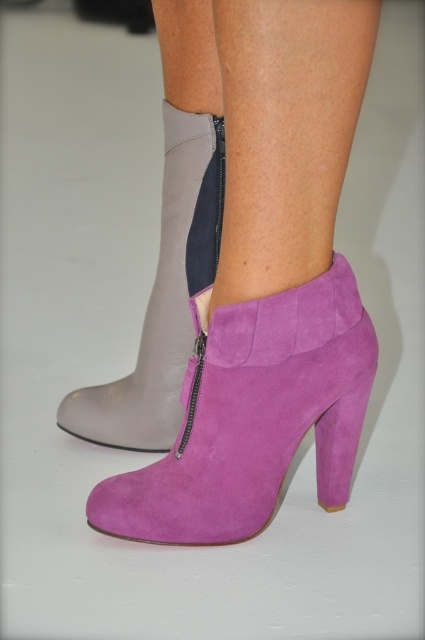
Question: Can you confirm if suede purple boot at lower right is wider than purple suede heel at lower right?

Choices:
 (A) no
 (B) yes

Answer: (B)

Question: Which point appears closest to the camera in this image?

Choices:
 (A) (282, 394)
 (B) (181, 212)
 (C) (132, 385)

Answer: (A)

Question: Which point appears closest to the camera in this image?

Choices:
 (A) (x=325, y=504)
 (B) (x=192, y=118)

Answer: (B)

Question: Based on their relative distances, which object is nearer to the suede purple boot at lower right?

Choices:
 (A) purple suede boot at lower right
 (B) purple suede heel at lower right

Answer: (A)

Question: Can you confirm if suede boot at center is bigger than purple suede heel at lower right?

Choices:
 (A) yes
 (B) no

Answer: (A)

Question: Is suede purple boot at lower right closer to camera compared to suede boot at center?

Choices:
 (A) yes
 (B) no

Answer: (A)